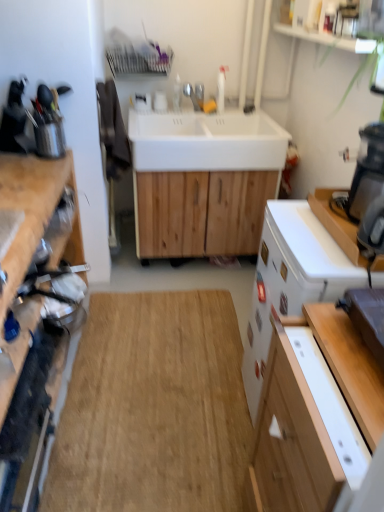
Question: Is white matte sink at center, arranged as the 1th sink when ordered from the bottom, bigger than metallic silver knife block at left?

Choices:
 (A) yes
 (B) no

Answer: (A)

Question: Is white matte sink at center, arranged as the 1th sink when ordered from the bottom, to the left of metallic silver knife block at left from the viewer's perspective?

Choices:
 (A) yes
 (B) no

Answer: (B)

Question: Does white matte sink at center, arranged as the 1th sink when ordered from the bottom, have a smaller size compared to metallic silver knife block at left?

Choices:
 (A) no
 (B) yes

Answer: (A)

Question: Does white matte sink at center, arranged as the 1th sink when ordered from the bottom, have a greater height compared to metallic silver knife block at left?

Choices:
 (A) no
 (B) yes

Answer: (B)

Question: Does white matte sink at center, arranged as the 1th sink when ordered from the bottom, have a lesser width compared to metallic silver knife block at left?

Choices:
 (A) no
 (B) yes

Answer: (A)

Question: From the image's perspective, is white matte sink at center, arranged as the 1th sink when ordered from the bottom, on top of metallic silver knife block at left?

Choices:
 (A) yes
 (B) no

Answer: (B)

Question: Considering the relative sizes of white glossy sink at center, which appears as the 1th sink when viewed from the top, and white glossy dishwasher at right in the image provided, is white glossy sink at center, which appears as the 1th sink when viewed from the top, shorter than white glossy dishwasher at right?

Choices:
 (A) no
 (B) yes

Answer: (B)

Question: Is white glossy dishwasher at right surrounded by white glossy sink at center, which appears as the 1th sink when viewed from the top?

Choices:
 (A) yes
 (B) no

Answer: (B)

Question: Is white glossy sink at center, arranged as the 2th sink when ordered from the bottom, not within white glossy dishwasher at right?

Choices:
 (A) no
 (B) yes

Answer: (B)

Question: Is white glossy sink at center, arranged as the 2th sink when ordered from the bottom, looking in the opposite direction of white glossy dishwasher at right?

Choices:
 (A) yes
 (B) no

Answer: (B)

Question: Is white glossy sink at center, arranged as the 2th sink when ordered from the bottom, behind white glossy dishwasher at right?

Choices:
 (A) no
 (B) yes

Answer: (B)

Question: Is white glossy sink at center, arranged as the 2th sink when ordered from the bottom, taller than white glossy dishwasher at right?

Choices:
 (A) no
 (B) yes

Answer: (A)

Question: Does natural wood table at center have a greater height compared to metallic silver knife block at left?

Choices:
 (A) no
 (B) yes

Answer: (A)